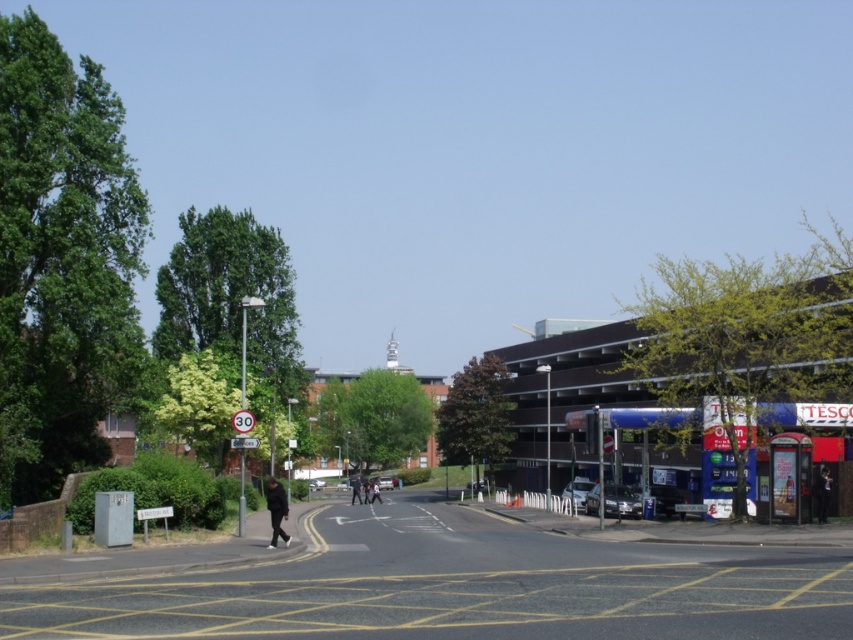
Does white plastic sign at left have a greater width compared to black matte person at center?

Incorrect, white plastic sign at left's width does not surpass black matte person at center's.

Who is positioned more to the right, white plastic sign at left or black matte person at center?

white plastic sign at left

Does point (254, 440) come closer to viewer compared to point (378, 493)?

That is True.

Where is `white plastic sign at left`? This screenshot has width=853, height=640. white plastic sign at left is located at coordinates (244, 442).

Which is behind, point (268, 497) or point (239, 448)?

Point (239, 448)

Is the position of dark blue jacket at lower left less distant than that of white plastic sign at left?

That is True.

The image size is (853, 640). Identify the location of dark blue jacket at lower left. (276, 509).

Consider the image. Is black matte jacket at center positioned at the back of white plastic sign at left?

Yes, it is behind white plastic sign at left.

Can you confirm if black matte jacket at center is wider than white plastic sign at left?

In fact, black matte jacket at center might be narrower than white plastic sign at left.

Which is in front, point (816, 513) or point (247, 448)?

Point (247, 448)

Find the location of a particular element. black matte jacket at center is located at coordinates (822, 493).